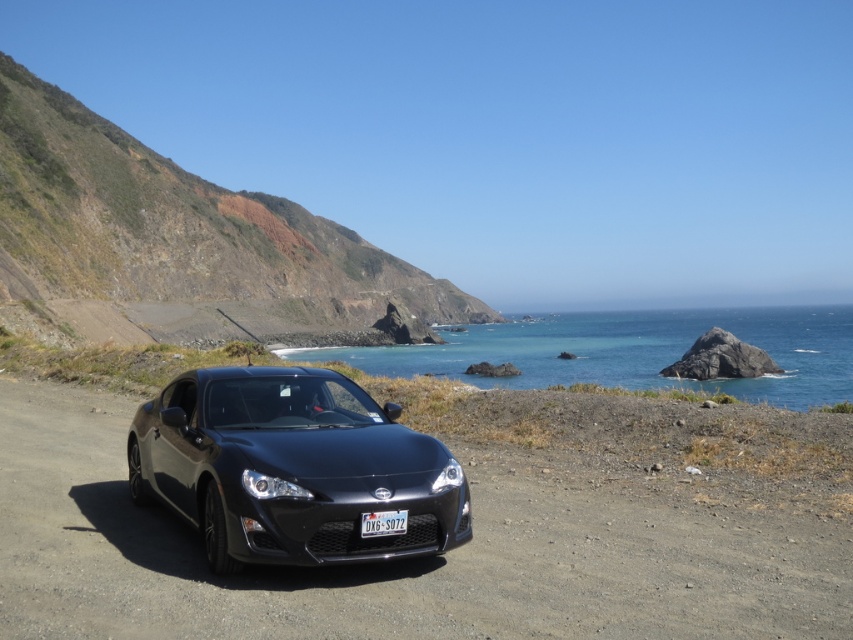
Does glossy black car at center have a greater height compared to rustic stone cliff at upper left?

Incorrect, glossy black car at center's height is not larger of rustic stone cliff at upper left's.

Does glossy black car at center have a larger size compared to rustic stone cliff at upper left?

Actually, glossy black car at center might be smaller than rustic stone cliff at upper left.

Measure the distance between glossy black car at center and camera.

glossy black car at center is 4.01 meters from camera.

Identify the location of glossy black car at center. (405, 561).

Image resolution: width=853 pixels, height=640 pixels. Identify the location of rustic stone cliff at upper left. (x=180, y=246).

Where is `rustic stone cliff at upper left`? rustic stone cliff at upper left is located at coordinates (180, 246).

Does glossy black car at center have a lesser height compared to matte black car at center?

Yes, glossy black car at center is shorter than matte black car at center.

Does glossy black car at center have a greater height compared to matte black car at center?

No.

You are a GUI agent. You are given a task and a screenshot of the screen. Output one action in this format:
    pyautogui.click(x=<x>, y=<y>)
    Task: Click on the glossy black car at center
    The image size is (853, 640).
    Given the screenshot: What is the action you would take?
    pyautogui.click(x=405, y=561)